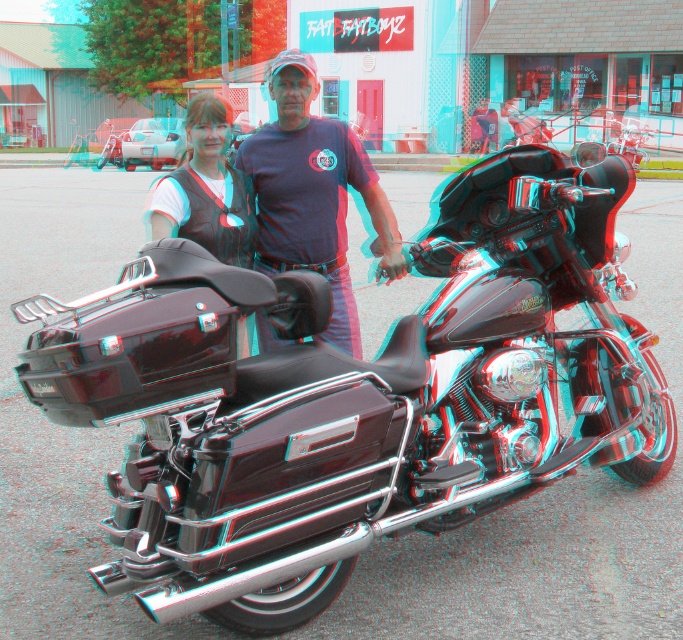
Question: Observing the image, what is the correct spatial positioning of matte blue shirt at center in reference to matte black vest at center?

Choices:
 (A) left
 (B) right

Answer: (B)

Question: Which of the following is the farthest from the observer?

Choices:
 (A) matte black vest at center
 (B) matte blue shirt at center

Answer: (B)

Question: Does matte blue shirt at center appear over matte black vest at center?

Choices:
 (A) no
 (B) yes

Answer: (A)

Question: Does matte blue shirt at center lie in front of matte black vest at center?

Choices:
 (A) no
 (B) yes

Answer: (A)